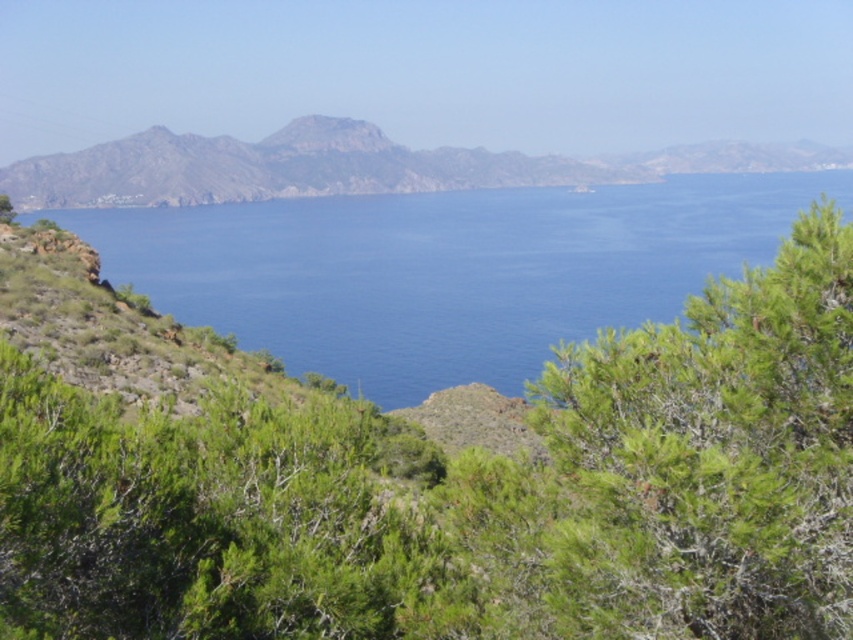
You are standing at the edge of the coastal landscape and want to walk towards the rugged brown mountain at center. Which direction should you move relative to the green leafy shrub at right?

You should move to the right of the green leafy shrub at right because the rugged brown mountain at center is located to the left of it.

You are standing at the coastal landscape and want to walk towards the two points marked in the image. Based on the scene description, which point, point (764,618) or point (370,134), is closer to you?

Point (764,618) is closer to the viewer than point (370,134).